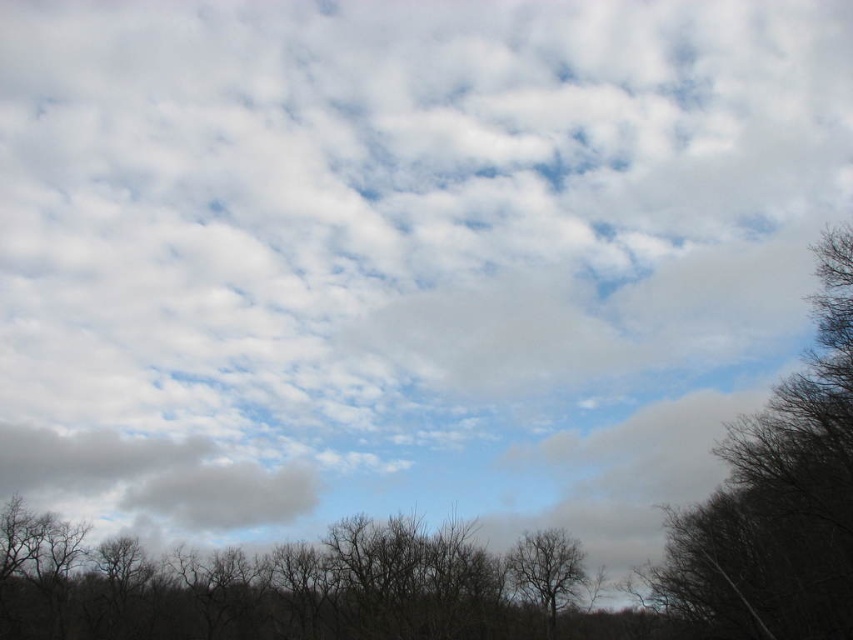
Which of these two, bare branches at right or gray fluffy cloud at lower left, stands taller?

bare branches at right

Which is more to the left, bare branches at right or gray fluffy cloud at lower left?

gray fluffy cloud at lower left is more to the left.

Which is in front, point (703, 550) or point (132, 477)?

Point (703, 550) is in front.

In order to click on bare branches at right in this screenshot , I will do `click(778, 499)`.

Is brown/dry wood trees at center smaller than gray fluffy cloud at lower left?

Actually, brown/dry wood trees at center might be larger than gray fluffy cloud at lower left.

Which is in front, point (287, 545) or point (151, 488)?

Positioned in front is point (287, 545).

In order to click on brown/dry wood trees at center in this screenshot , I will do `click(256, 588)`.

Is bare branches at right shorter than bare branches at center?

No.

Is point (737, 460) farther from camera compared to point (556, 595)?

That is False.

What do you see at coordinates (778, 499) in the screenshot?
I see `bare branches at right` at bounding box center [778, 499].

This screenshot has height=640, width=853. I want to click on bare branches at right, so click(778, 499).